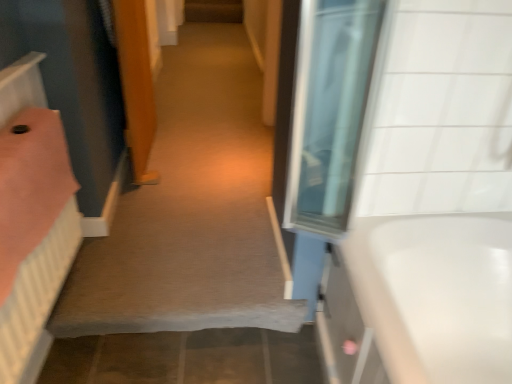
Question: Do you think carpet at center is within wooden door at center, or outside of it?

Choices:
 (A) inside
 (B) outside

Answer: (B)

Question: In the image, is carpet at center on the left side or the right side of wooden door at center?

Choices:
 (A) right
 (B) left

Answer: (A)

Question: Which of these objects is positioned farthest from the pink fabric bed at left?

Choices:
 (A) carpet at center
 (B) white glossy bathtub at right
 (C) wooden door at center

Answer: (B)

Question: Based on their relative distances, which object is nearer to the wooden door at center?

Choices:
 (A) white glossy bathtub at right
 (B) pink fabric bed at left
 (C) carpet at center

Answer: (C)